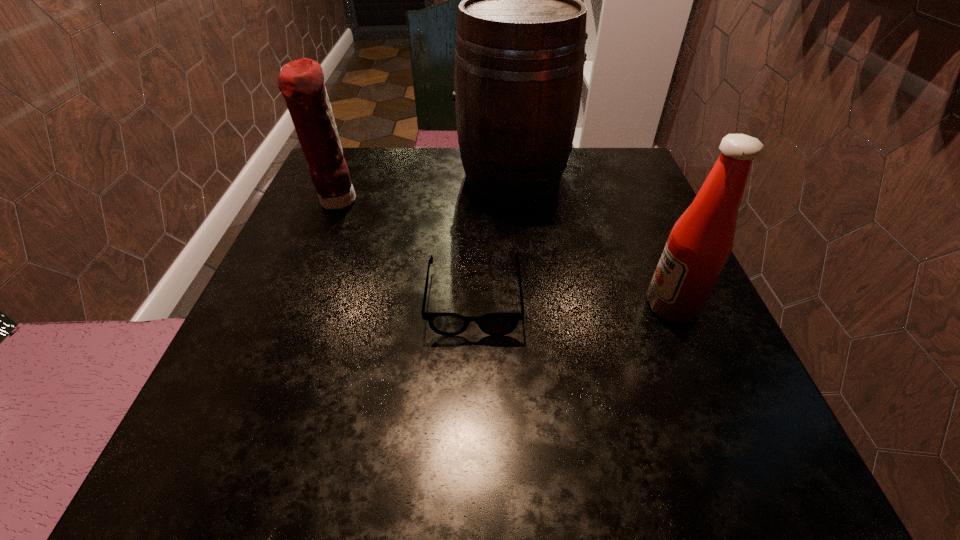
You are a GUI agent. You are given a task and a screenshot of the screen. Output one action in this format:
    pyautogui.click(x=<x>, y=<y>)
    Task: Click on the tallest object
    
    Given the screenshot: What is the action you would take?
    pyautogui.click(x=521, y=28)

The height and width of the screenshot is (540, 960). I want to click on the rightmost object, so click(698, 246).

Locate an element on the screen. Image resolution: width=960 pixels, height=540 pixels. the right condiment is located at coordinates click(x=698, y=246).

The image size is (960, 540). In order to click on the farther condiment in this screenshot , I will do `click(301, 82)`.

The height and width of the screenshot is (540, 960). I want to click on the leftmost object, so click(301, 82).

Identify the location of the shortest object. (502, 323).

At what (x,y) coordinates should I click in order to perform the action: click on vacant space located 0.290m on the side of the tallest object near the bung hole. Please return your answer as a coordinate pair (x, y). This screenshot has width=960, height=540. Looking at the image, I should click on (332, 176).

At what (x,y) coordinates should I click in order to perform the action: click on vacant area situated 0.130m on the side of the tallest object near the bung hole. Please return your answer as a coordinate pair (x, y). Looking at the image, I should click on (400, 176).

The image size is (960, 540). What are the coordinates of `free space located 0.090m on the side of the tallest object near the bung hole` in the screenshot? It's located at (418, 176).

What are the coordinates of `vacant space located on the front-facing side of the rightmost object` in the screenshot? It's located at (581, 306).